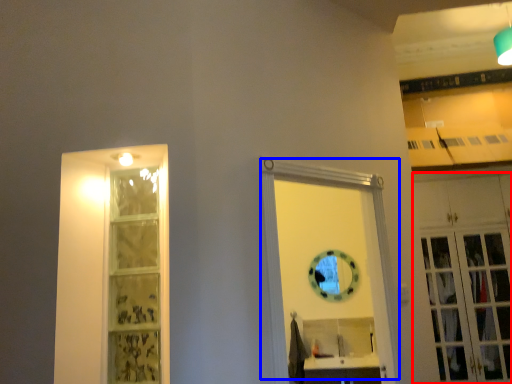
Question: Which object is further to the camera taking this photo, cabinetry (highlighted by a red box) or door (highlighted by a blue box)?

Choices:
 (A) cabinetry
 (B) door

Answer: (A)